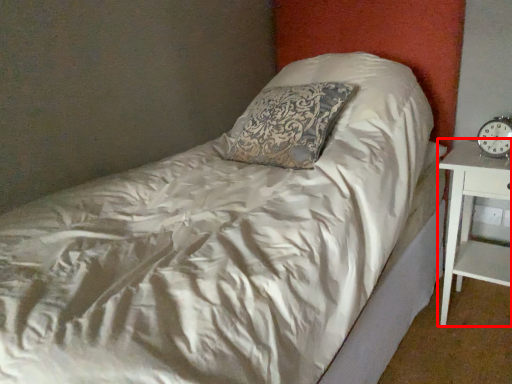
Question: In this image, where is nightstand (annotated by the red box) located relative to clock?

Choices:
 (A) left
 (B) right

Answer: (B)